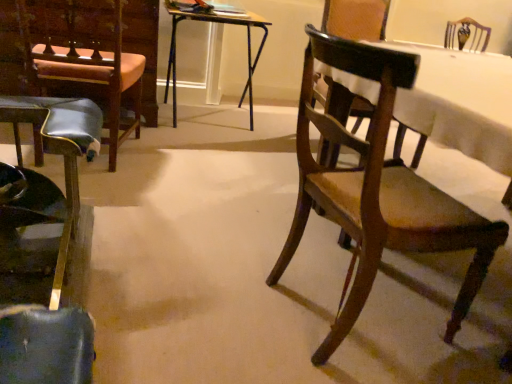
Question: From the image's perspective, is wooden chair at right, the second armchair viewed from the left, below wooden folding table at center?

Choices:
 (A) yes
 (B) no

Answer: (A)

Question: Considering the relative sizes of wooden chair at right, the second armchair viewed from the left, and wooden folding table at center in the image provided, is wooden chair at right, the second armchair viewed from the left, taller than wooden folding table at center?

Choices:
 (A) no
 (B) yes

Answer: (B)

Question: Considering the relative sizes of wooden chair at right, the 1th armchair from the right, and wooden folding table at center in the image provided, is wooden chair at right, the 1th armchair from the right, thinner than wooden folding table at center?

Choices:
 (A) no
 (B) yes

Answer: (B)

Question: Is wooden chair at right, the 1th armchair from the right, bigger than wooden folding table at center?

Choices:
 (A) yes
 (B) no

Answer: (A)

Question: Does wooden chair at right, the second armchair viewed from the left, have a greater width compared to wooden folding table at center?

Choices:
 (A) no
 (B) yes

Answer: (A)

Question: Is wooden chair at right, the second armchair viewed from the left, to the left or to the right of wooden folding table at center in the image?

Choices:
 (A) right
 (B) left

Answer: (A)

Question: Is wooden chair at right, the 1th armchair from the right, wider or thinner than wooden folding table at center?

Choices:
 (A) wide
 (B) thin

Answer: (B)

Question: Relative to wooden folding table at center, is wooden chair at right, the 1th armchair from the right, in front or behind?

Choices:
 (A) front
 (B) behind

Answer: (A)

Question: From the image's perspective, is wooden chair at right, the 1th armchair from the right, above or below wooden folding table at center?

Choices:
 (A) above
 (B) below

Answer: (B)

Question: Visually, is wooden chair at right, positioned as the 2th chair in left-to-right order, positioned to the left or to the right of wooden folding table at center?

Choices:
 (A) left
 (B) right

Answer: (B)

Question: Is wooden chair at right, positioned as the 2th chair in left-to-right order, taller or shorter than wooden folding table at center?

Choices:
 (A) short
 (B) tall

Answer: (B)

Question: From the image's perspective, relative to wooden folding table at center, is wooden chair at right, positioned as the 2th chair in left-to-right order, above or below?

Choices:
 (A) below
 (B) above

Answer: (A)

Question: Looking at the image, does wooden chair at right, the first chair positioned from the right, seem bigger or smaller compared to wooden folding table at center?

Choices:
 (A) small
 (B) big

Answer: (B)

Question: Is leather seat at left, the second armchair viewed from the right, taller or shorter than wooden chair at right, the first chair positioned from the right?

Choices:
 (A) short
 (B) tall

Answer: (B)

Question: Is leather seat at left, the first armchair positioned from the left, bigger or smaller than wooden chair at right, positioned as the 2th chair in left-to-right order?

Choices:
 (A) big
 (B) small

Answer: (B)